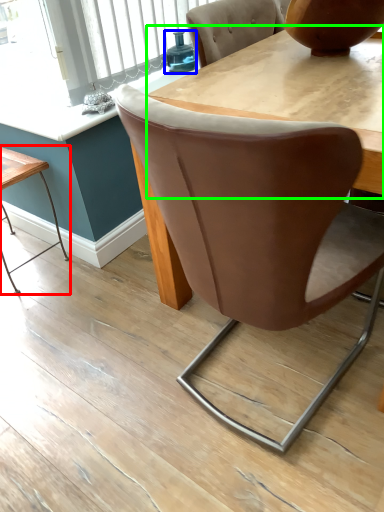
Question: Based on their relative distances, which object is nearer to table (highlighted by a red box)? Choose from teal (highlighted by a blue box) and round table (highlighted by a green box).

Choices:
 (A) teal
 (B) round table

Answer: (A)